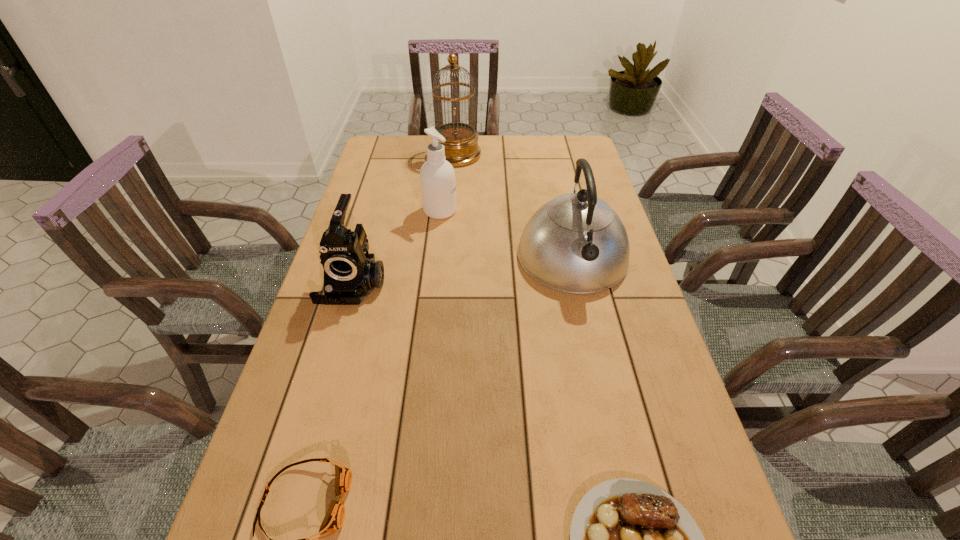
Where is `the third closest object to the tallest object`? the third closest object to the tallest object is located at coordinates (350, 274).

Identify which object is the third nearest to the farthest object. Please provide its 2D coordinates. Your answer should be formatted as a tuple, i.e. [(x, y)], where the tuple contains the x and y coordinates of a point satisfying the conditions above.

[(350, 274)]

The image size is (960, 540). Find the location of `vacant region that satisfies the following two spatial constraints: 1. on the front label of the cleansing agent; 2. on the lens mount of the camcorder`. vacant region that satisfies the following two spatial constraints: 1. on the front label of the cleansing agent; 2. on the lens mount of the camcorder is located at coordinates (432, 284).